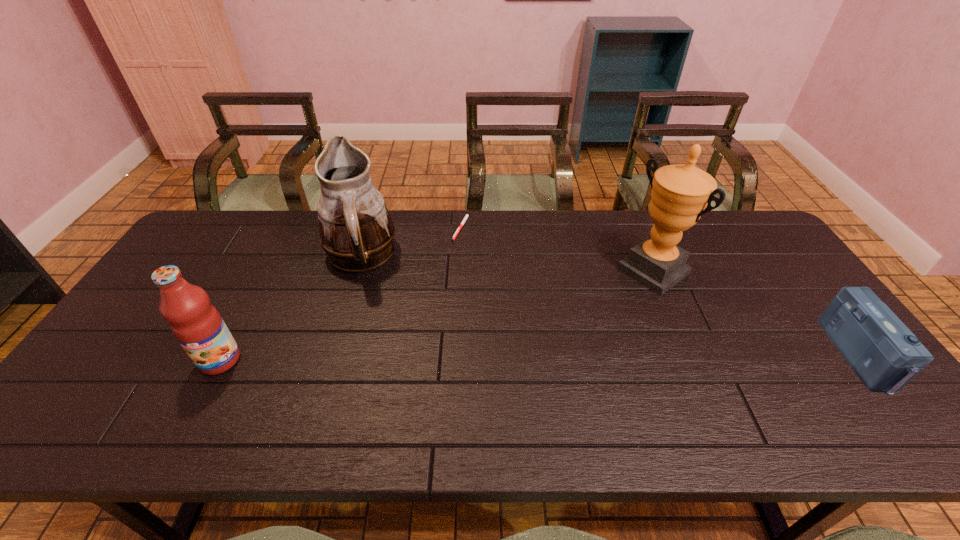
Identify the location of vacant space located on the clicker of the third object from left to right. The image size is (960, 540). (469, 264).

This screenshot has height=540, width=960. In order to click on vacant space located 0.200m on the clicker of the third object from left to right in this screenshot , I will do `click(476, 283)`.

In order to click on vacant space situated 0.200m from the spout of the second tallest object in this screenshot , I will do `click(435, 307)`.

Locate an element on the screen. free space located from the spout of the second tallest object is located at coordinates (424, 300).

Identify the location of vacant area situated from the spout of the second tallest object. The width and height of the screenshot is (960, 540). [x=468, y=326].

Find the location of `vacant space located 0.170m at the front of the fourth object from left to right with handles`. vacant space located 0.170m at the front of the fourth object from left to right with handles is located at coordinates (593, 314).

Find the location of `vacant space situated 0.270m at the front of the fourth object from left to right with handles`. vacant space situated 0.270m at the front of the fourth object from left to right with handles is located at coordinates (568, 332).

Find the location of a particular element. vacant space located at the front of the fourth object from left to right with handles is located at coordinates point(593,314).

Where is `pen that is at the far edge`? pen that is at the far edge is located at coordinates (465, 218).

You are a GUI agent. You are given a task and a screenshot of the screen. Output one action in this format:
    pyautogui.click(x=<x>, y=<y>)
    Task: Click on the pitcher that is positioned at the far edge
    The height and width of the screenshot is (540, 960).
    Given the screenshot: What is the action you would take?
    pyautogui.click(x=356, y=232)